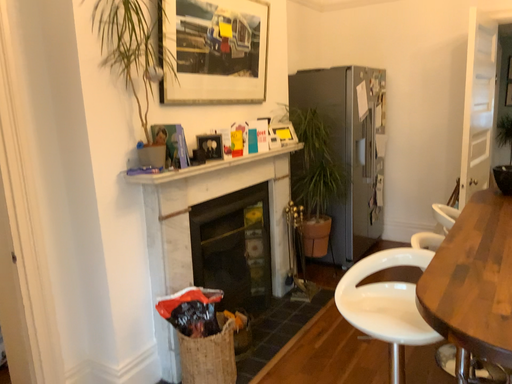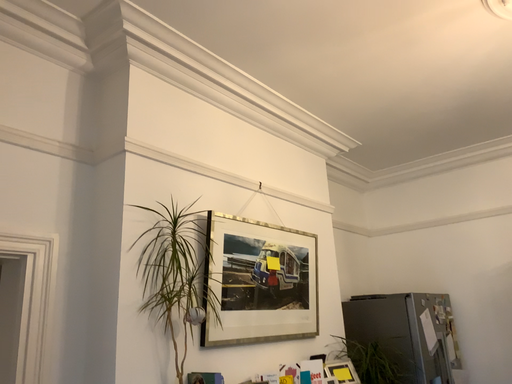
Question: How did the camera likely rotate when shooting the video?

Choices:
 (A) rotated upward
 (B) rotated downward

Answer: (A)